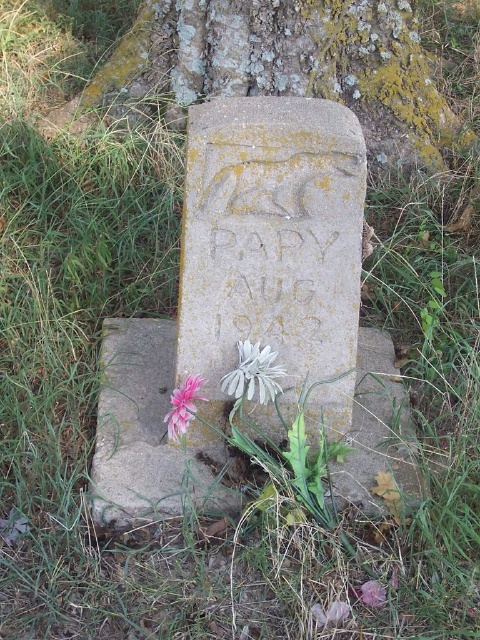
Does white matte flower at center have a lesser height compared to pink matte flower at lower left?

Correct, white matte flower at center is not as tall as pink matte flower at lower left.

This screenshot has width=480, height=640. Identify the location of white matte flower at center. (253, 372).

Does point (153, 428) come farther from viewer compared to point (183, 397)?

Yes, point (153, 428) is farther from viewer.

Identify the location of stone at center. (148, 435).

Is point (377, 157) less distant than point (373, 406)?

No.

Can you confirm if green mossy stone at center is taller than stone at center?

Yes, green mossy stone at center is taller than stone at center.

Is point (206, 33) farther from camera compared to point (108, 332)?

Yes, it is.

Image resolution: width=480 pixels, height=640 pixels. Identify the location of green mossy stone at center. (284, 65).